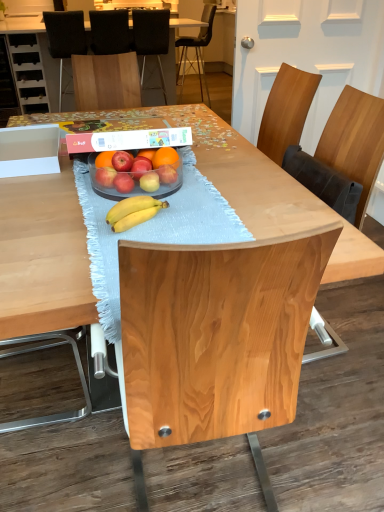
The width and height of the screenshot is (384, 512). What are the coordinates of `vacant area that lies in front of matte red apple at center, which is the 3th apple from left to right` in the screenshot? It's located at (131, 220).